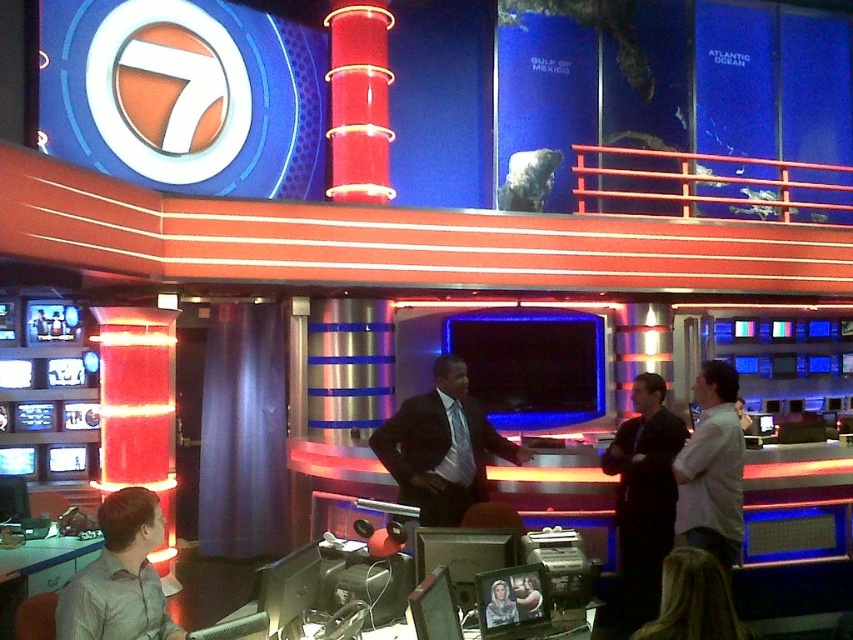
Can you confirm if white shirt at center is positioned to the left of smooth skin portrait at center?

In fact, white shirt at center is to the right of smooth skin portrait at center.

Which is behind, point (693, 512) or point (500, 611)?

Point (693, 512)

Locate an element on the screen. This screenshot has height=640, width=853. white shirt at center is located at coordinates 712,468.

The width and height of the screenshot is (853, 640). Describe the element at coordinates (440, 445) in the screenshot. I see `matte black suit at center` at that location.

Who is shorter, matte black suit at center or smooth skin portrait at center?

Standing shorter between the two is smooth skin portrait at center.

In the scene shown: Who is more distant from viewer, (421, 490) or (503, 602)?

The point (421, 490) is more distant.

Where is `matte black suit at center`? matte black suit at center is located at coordinates (440, 445).

From the picture: Does smooth skin portrait at center appear on the left side of smooth skin person at center?

Correct, you'll find smooth skin portrait at center to the left of smooth skin person at center.

Who is more distant from viewer, (509, 600) or (527, 593)?

Point (527, 593)

Between point (495, 620) and point (527, 582), which one is positioned behind?

The point (527, 582) is more distant.

The image size is (853, 640). In order to click on smooth skin portrait at center in this screenshot , I will do `click(500, 604)`.